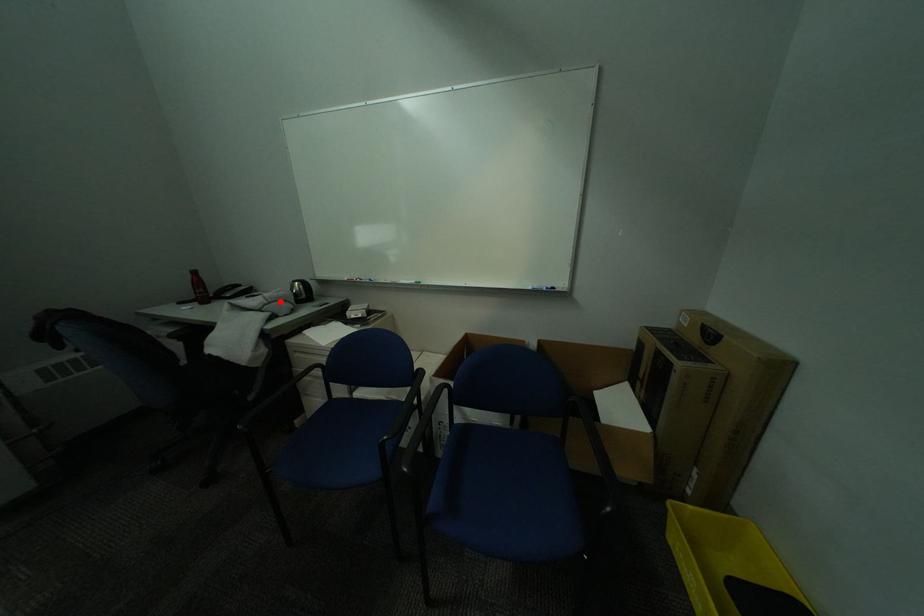
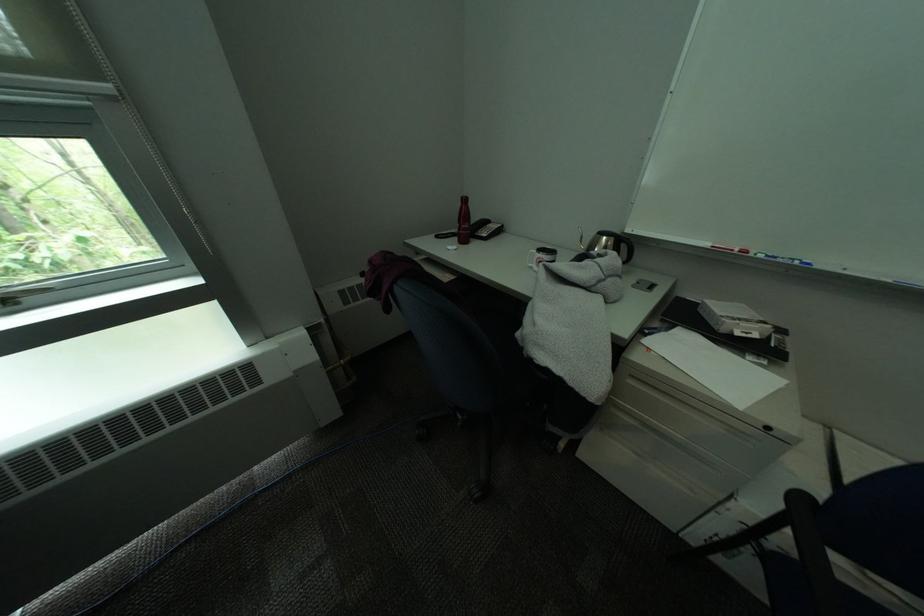
Question: A red point is marked in image1. In image2, is the corresponding 3D point closer to the camera or farther? Reply with the corresponding letter.

Choices:
 (A) The corresponding 3D point is closer.
 (B) The corresponding 3D point is farther.

Answer: (B)